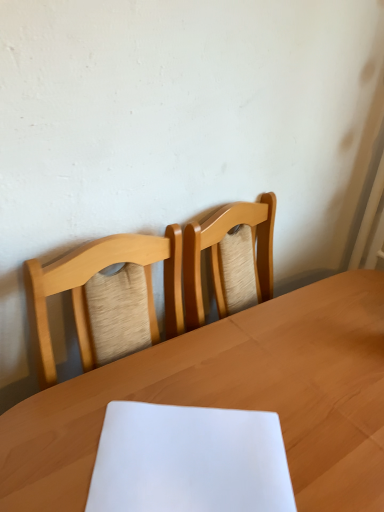
The image size is (384, 512). I want to click on free spot above light wood table at center (from a real-world perspective), so click(268, 386).